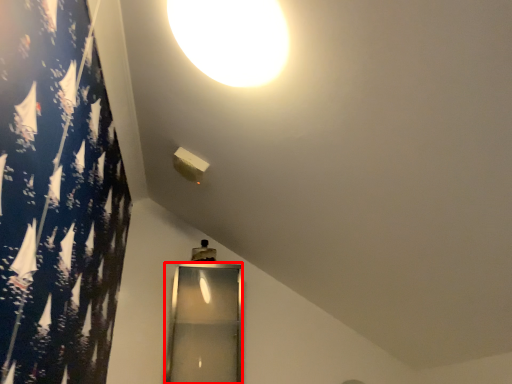
Question: From the image's perspective, where is glass door (annotated by the red box) located relative to lamp?

Choices:
 (A) below
 (B) above

Answer: (A)